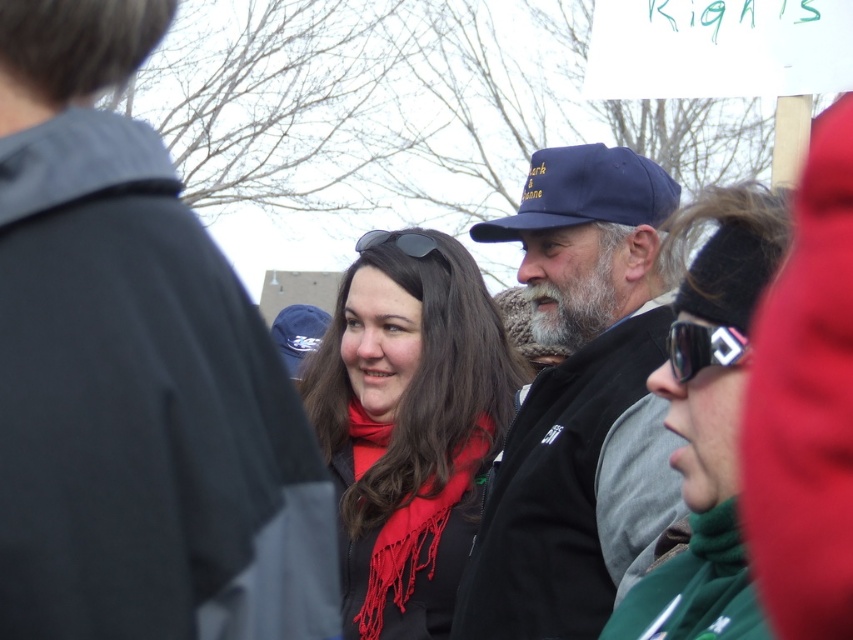
Is dark blue cap at center to the right of matte red scarf at center from the viewer's perspective?

Incorrect, dark blue cap at center is not on the right side of matte red scarf at center.

Based on the photo, who is lower down, dark blue cap at center or matte red scarf at center?

matte red scarf at center is lower down.

The image size is (853, 640). Describe the element at coordinates (135, 372) in the screenshot. I see `dark blue cap at center` at that location.

Locate an element on the screen. dark blue cap at center is located at coordinates (135, 372).

Which is more to the right, dark blue cap at center or matte black sunglasses at center?

From the viewer's perspective, dark blue cap at center appears more on the right side.

Can you confirm if dark blue cap at center is thinner than matte black sunglasses at center?

Yes.

Who is more forward, (216, 349) or (368, 230)?

Point (216, 349)

Where is `dark blue cap at center`? This screenshot has height=640, width=853. dark blue cap at center is located at coordinates (135, 372).

From the picture: Who is taller, blue fabric cap at center or matte black jacket at center?

A: With more height is blue fabric cap at center.

Who is lower down, blue fabric cap at center or matte black jacket at center?

matte black jacket at center

Where is `blue fabric cap at center`? The width and height of the screenshot is (853, 640). blue fabric cap at center is located at coordinates (578, 403).

This screenshot has height=640, width=853. Find the location of `blue fabric cap at center`. blue fabric cap at center is located at coordinates (578, 403).